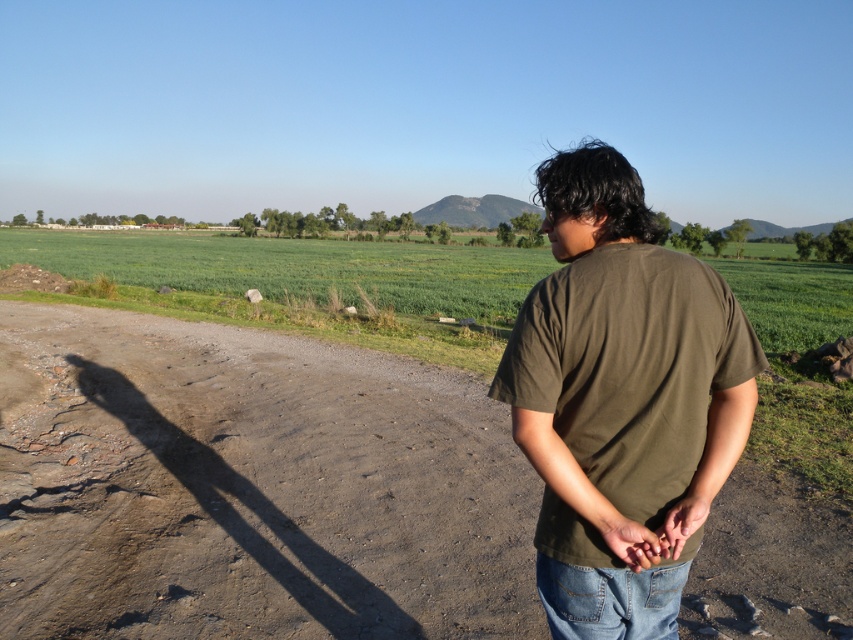
Does dirt track at center appear over olive green t-shirt at center?

No, dirt track at center is not above olive green t-shirt at center.

Does dirt track at center have a greater width compared to olive green t-shirt at center?

Indeed, dirt track at center has a greater width compared to olive green t-shirt at center.

Between point (300, 428) and point (595, 490), which one is positioned behind?

The point (300, 428) is more distant.

Locate an element on the screen. This screenshot has height=640, width=853. dirt track at center is located at coordinates (250, 486).

Does dirt track at center appear over jeans at lower right?

Actually, dirt track at center is below jeans at lower right.

Identify the location of dirt track at center. click(250, 486).

The image size is (853, 640). What do you see at coordinates (250, 486) in the screenshot?
I see `dirt track at center` at bounding box center [250, 486].

Locate an element on the screen. The height and width of the screenshot is (640, 853). dirt track at center is located at coordinates (250, 486).

Can you confirm if dirt track at center is bigger than green grass field at center?

No.

Can you confirm if dirt track at center is taller than green grass field at center?

Incorrect, dirt track at center's height is not larger of green grass field at center's.

Who is more forward, [302,476] or [38,253]?

Point [302,476]

Where is `dirt track at center`? The image size is (853, 640). dirt track at center is located at coordinates (250, 486).